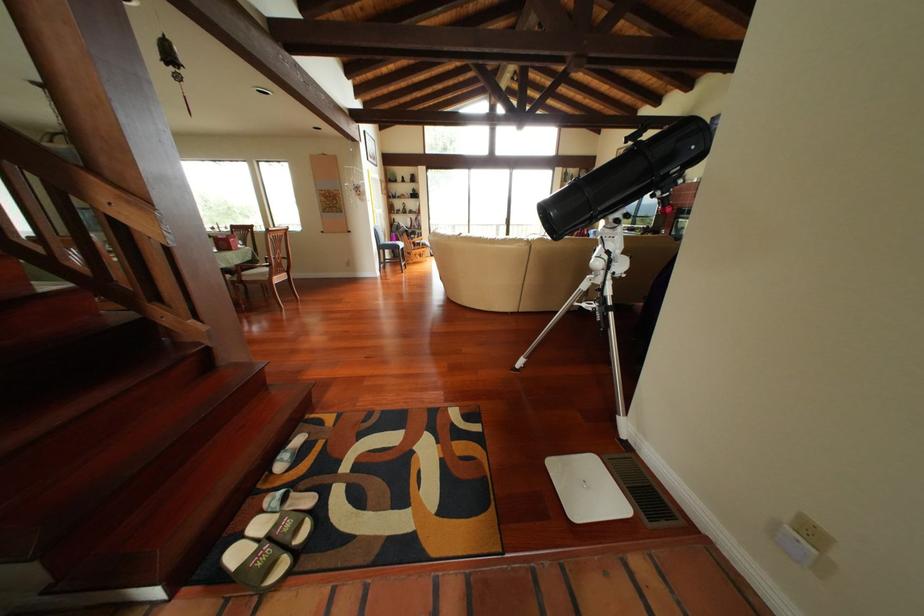
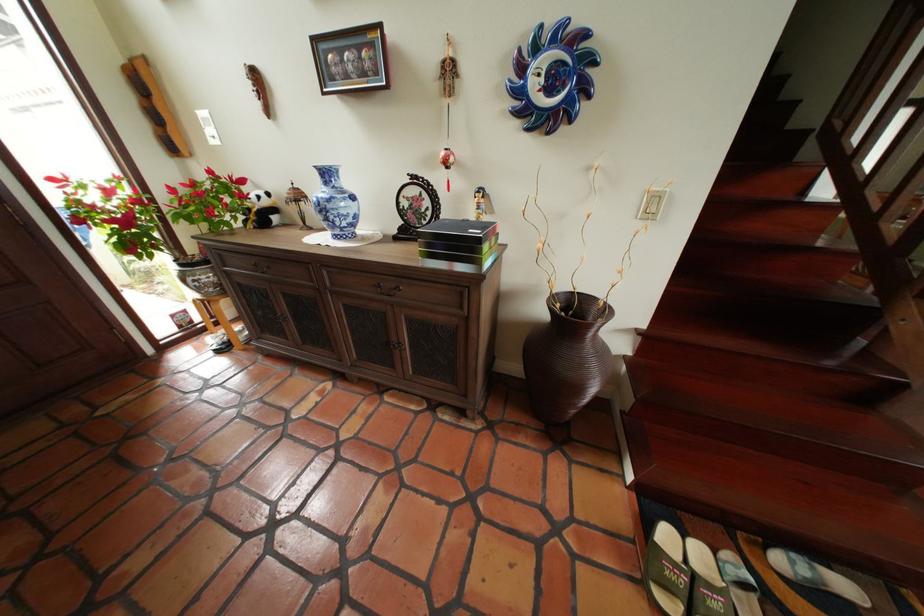
In the second image, find the point that corresponds to the point at 256,539 in the first image.

(697, 539)